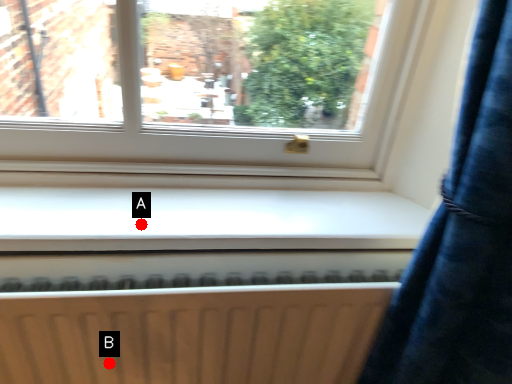
Question: Two points are circled on the image, labeled by A and B beside each circle. Which point is farther from the camera taking this photo?

Choices:
 (A) A is further
 (B) B is further

Answer: (B)